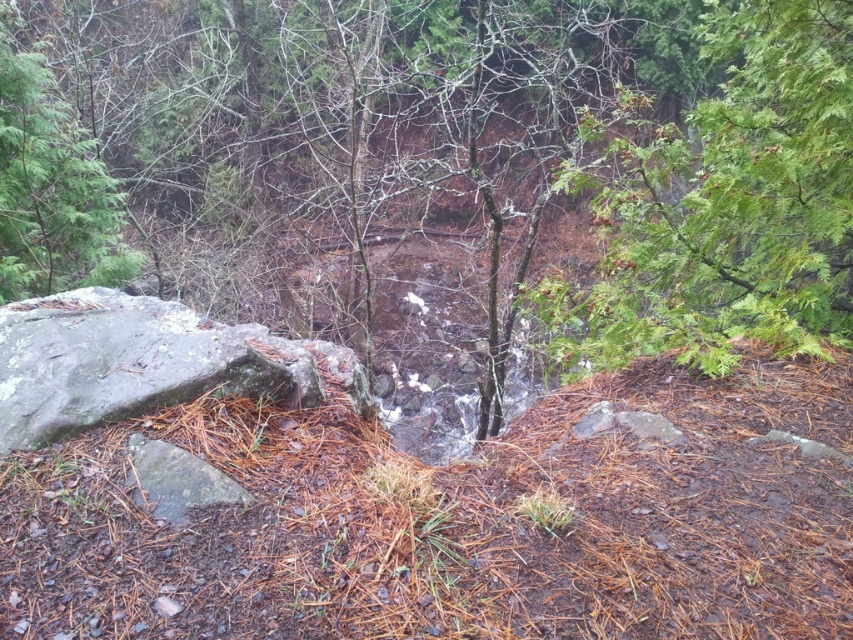
You are a hiker trying to cross the stream in the forest. You notice two trees nearby for guidance. The green textured tree at center and the green leafy tree at upper right. Which tree should you look at to determine your direction if you want to go upstream?

You should look at the green leafy tree at upper right because it is behind the green textured tree at center, meaning it is further away from your current position. Since it is upstream, you should head towards it.

You are an environmental scientist studying the forest. You need to determine which tree has a greater height between the green textured tree at center and the green matte tree at upper left. Which one is taller?

The green textured tree at center has a larger size compared to the green matte tree at upper left, so it is taller.

You are a hiker navigating through this forest and want to cross the stream. You notice a green textured tree at center and a green matte tree at upper left. Which tree should you head towards if you want to cross the stream first?

The green textured tree at center is to the right of the green matte tree at upper left. Since the stream flows through the center, heading towards the green textured tree at center would place you closer to the stream, allowing you to cross it first before reaching the green matte tree at upper left.